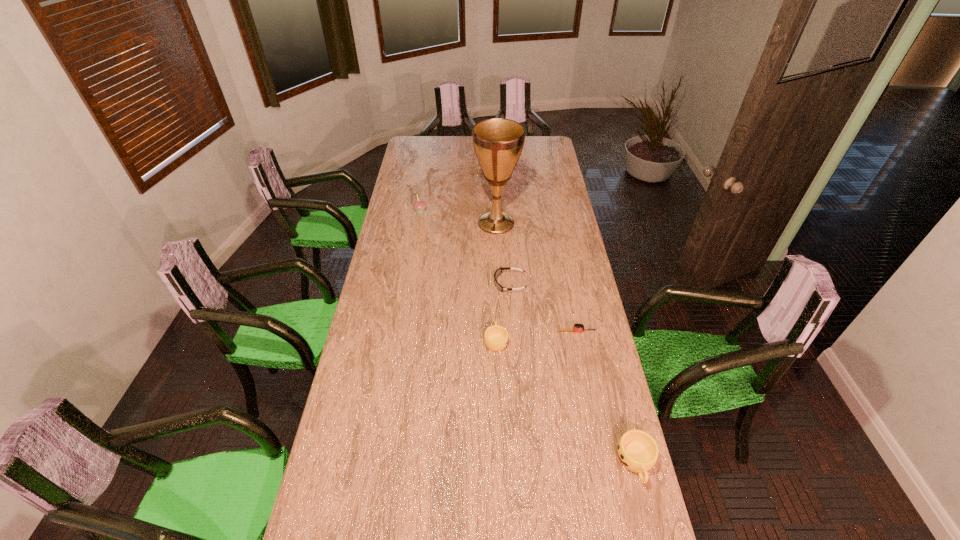
Where is `cup at the right edge`? The height and width of the screenshot is (540, 960). cup at the right edge is located at coordinates (637, 451).

In order to click on tape measure that is at the right edge in this screenshot , I will do pos(577,327).

Locate an element on the screen. This screenshot has width=960, height=540. object that is positioned at the near right corner is located at coordinates (637, 451).

Find the location of a particular element. vacant region at the near edge is located at coordinates (472, 501).

Find the location of `vacant region at the left edge of the desktop`. vacant region at the left edge of the desktop is located at coordinates (404, 203).

Locate an element on the screen. The image size is (960, 540). vacant area at the right edge of the desktop is located at coordinates (547, 175).

Where is `free space at the far left corner of the desktop`? The width and height of the screenshot is (960, 540). free space at the far left corner of the desktop is located at coordinates (417, 139).

Image resolution: width=960 pixels, height=540 pixels. In the image, there is a desktop. Find the location of `vacant area at the near left corner`. vacant area at the near left corner is located at coordinates (372, 497).

Locate an element on the screen. This screenshot has height=540, width=960. free space at the far right corner of the desktop is located at coordinates (540, 151).

Locate an element on the screen. free space that is in between the third farthest object and the fourth tallest object is located at coordinates (503, 312).